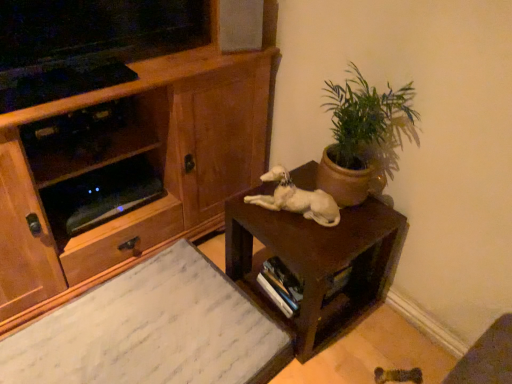
Where is `vacant space in white glossy dog at center (from a real-world perspective)`? The height and width of the screenshot is (384, 512). vacant space in white glossy dog at center (from a real-world perspective) is located at coordinates (289, 209).